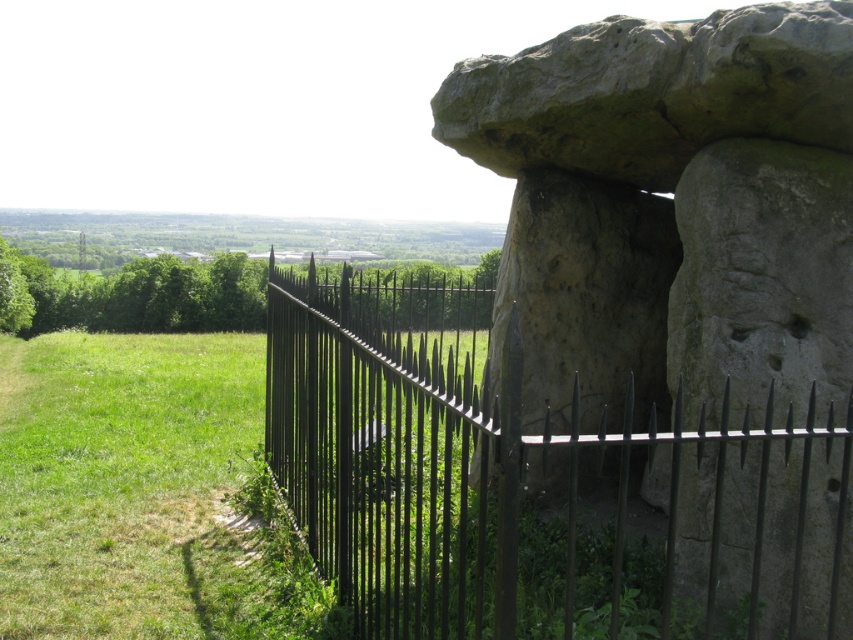
You are a visitor at the archaeological site and want to take a photo of the gray stone structure at center without the black metal fence at center appearing in the frame. Is this possible given their positions?

The black metal fence at center is behind the gray stone structure at center, so you can take a photo of the gray stone structure at center without the fence appearing in the frame by positioning yourself in front of the structure where the fence is obscured.

You are a tour guide explaining the ancient site to visitors. You mention both the gray stone structure at center and the black metal fence at center. Which one is taller?

The gray stone structure at center is taller than the black metal fence at center.